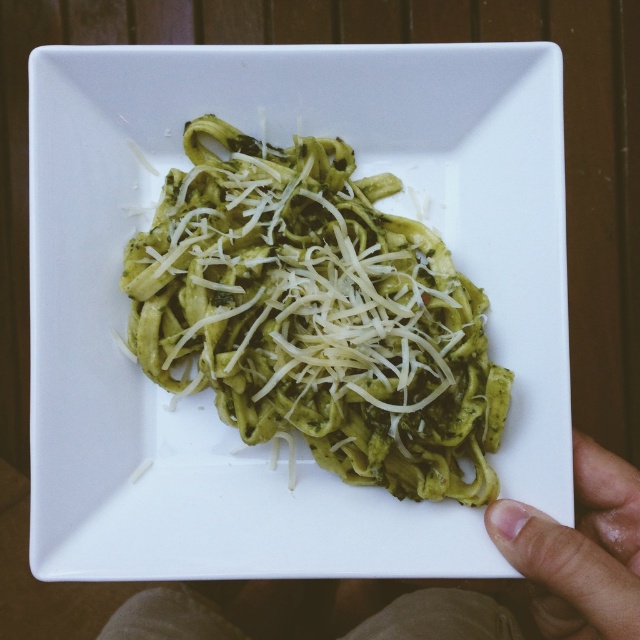
Question: Which object is positioned farthest from the green matte pasta at center?

Choices:
 (A) smooth skin hand at upper right
 (B) flesh-toned skin at lower right

Answer: (A)

Question: Does green matte pasta at center have a smaller size compared to flesh-toned skin at lower right?

Choices:
 (A) no
 (B) yes

Answer: (A)

Question: Which object is closer to the camera taking this photo?

Choices:
 (A) smooth skin hand at upper right
 (B) green matte pasta at center
 (C) flesh-toned skin at lower right

Answer: (C)

Question: Among these points, which one is farthest from the camera?

Choices:
 (A) (516, 515)
 (B) (410, 355)
 (C) (614, 621)

Answer: (B)

Question: Is green matte pasta at center closer to camera compared to flesh-toned skin at lower right?

Choices:
 (A) no
 (B) yes

Answer: (A)

Question: Does green matte pasta at center lie behind flesh-toned skin at lower right?

Choices:
 (A) yes
 (B) no

Answer: (A)